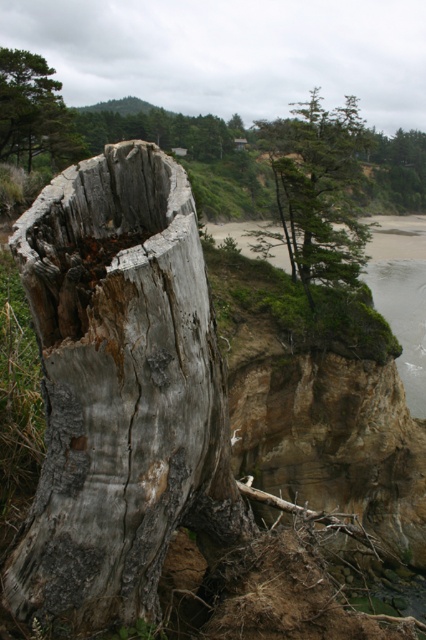
Question: Can you confirm if weathered wood tree trunk at left is positioned above green textured pine tree at upper left?

Choices:
 (A) yes
 (B) no

Answer: (B)

Question: Is weathered wood tree trunk at left to the left of green rough bark tree at upper center from the viewer's perspective?

Choices:
 (A) yes
 (B) no

Answer: (A)

Question: Does weathered wood tree trunk at left have a greater width compared to green textured pine tree at upper left?

Choices:
 (A) yes
 (B) no

Answer: (B)

Question: Which object is the closest to the green textured pine tree at upper left?

Choices:
 (A) green rough bark tree at upper center
 (B) weathered wood tree trunk at left

Answer: (B)

Question: Which object is the farthest from the green rough bark tree at upper center?

Choices:
 (A) weathered wood tree trunk at left
 (B) green textured pine tree at upper left

Answer: (B)

Question: Which of the following is the farthest from the observer?

Choices:
 (A) (40, 64)
 (B) (16, 582)
 (C) (325, 276)

Answer: (A)